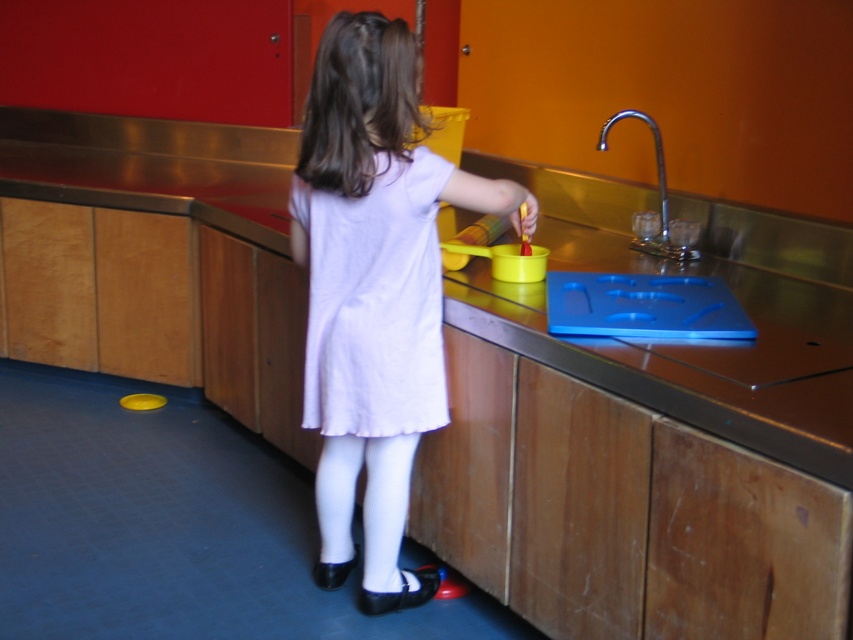
Question: Which is farther from the silver metallic faucet at upper right?

Choices:
 (A) white cotton dress at center
 (B) white matte dress at center

Answer: (A)

Question: Is white matte dress at center wider than white cotton dress at center?

Choices:
 (A) no
 (B) yes

Answer: (B)

Question: Does white matte dress at center appear over white cotton dress at center?

Choices:
 (A) no
 (B) yes

Answer: (A)

Question: Which point is closer to the camera taking this photo?

Choices:
 (A) (665, 189)
 (B) (416, 358)

Answer: (B)

Question: Is white cotton dress at center smaller than silver metallic faucet at upper right?

Choices:
 (A) no
 (B) yes

Answer: (A)

Question: Which point is closer to the camera?

Choices:
 (A) (602, 131)
 (B) (381, 326)

Answer: (B)